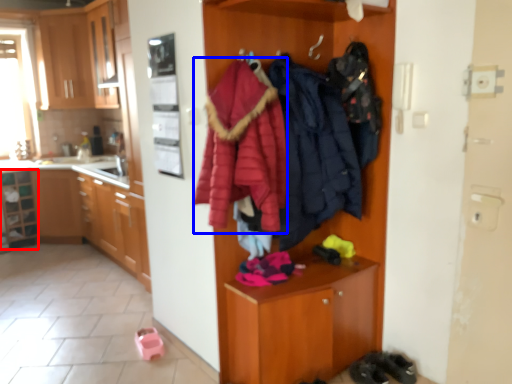
Question: Among these objects, which one is farthest to the camera, shelf (highlighted by a red box) or bathrobe (highlighted by a blue box)?

Choices:
 (A) shelf
 (B) bathrobe

Answer: (A)